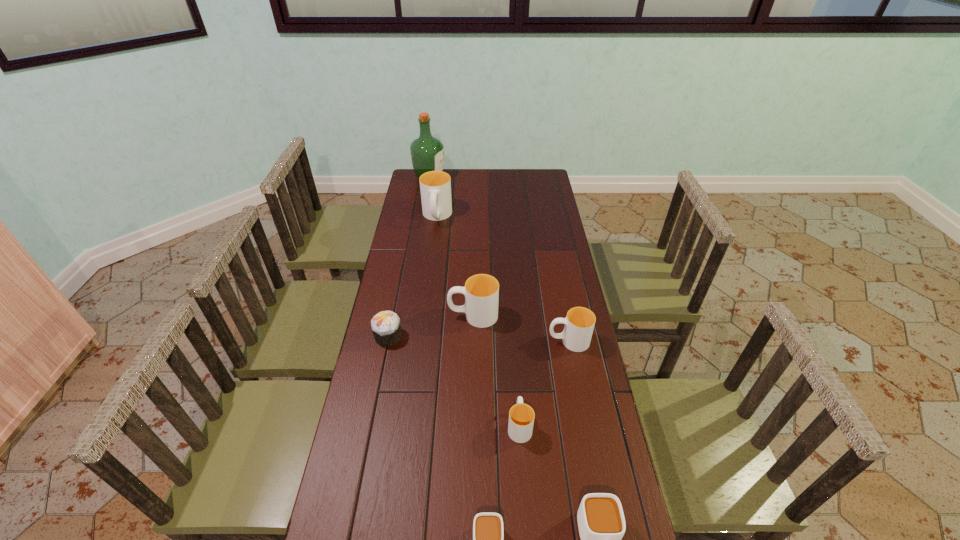
Find the location of a particular element. The width and height of the screenshot is (960, 540). the farthest object is located at coordinates (427, 152).

This screenshot has height=540, width=960. What are the coordinates of `liquor` in the screenshot? It's located at (427, 152).

You are a GUI agent. You are given a task and a screenshot of the screen. Output one action in this format:
    pyautogui.click(x=<x>, y=<y>)
    Task: Click on the leftmost cup
    This screenshot has width=960, height=540.
    Given the screenshot: What is the action you would take?
    pyautogui.click(x=435, y=186)

Find the location of a particular element. This screenshot has width=960, height=540. the farthest cup is located at coordinates (435, 186).

The height and width of the screenshot is (540, 960). I want to click on the second tallest cup, so click(x=481, y=291).

Where is `the third smallest yellow cup`? the third smallest yellow cup is located at coordinates (481, 291).

At what (x,y) coordinates should I click in order to perform the action: click on the third tallest cup. Please return your answer as a coordinate pair (x, y). This screenshot has height=540, width=960. Looking at the image, I should click on (579, 323).

Where is `the fourth tallest object`? The height and width of the screenshot is (540, 960). the fourth tallest object is located at coordinates (579, 323).

Where is `cupcake`? cupcake is located at coordinates (386, 327).

Image resolution: width=960 pixels, height=540 pixels. Identify the location of the sixth farthest object. (521, 416).